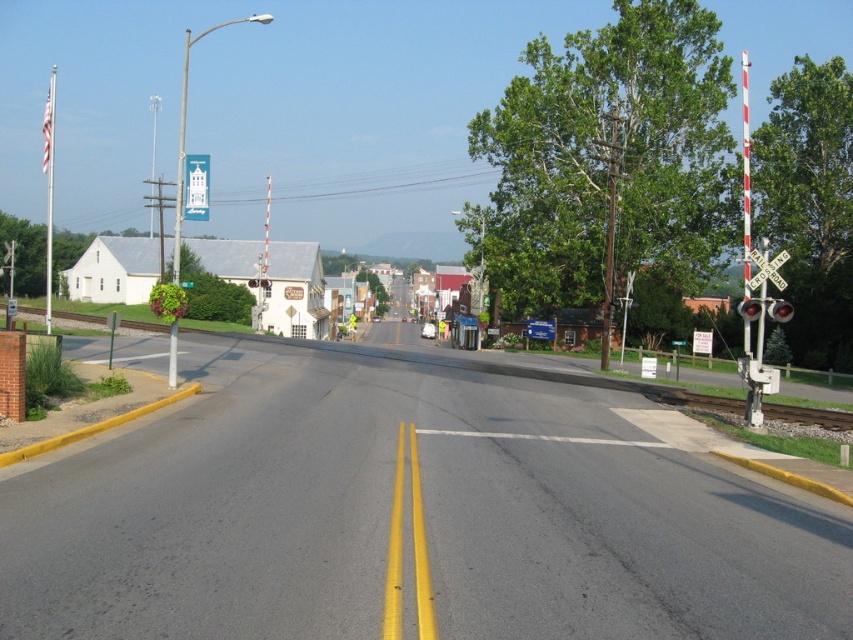
Looking at this image, you are standing at point (757,257) and want to walk to point (128,268). Based on the scene description, will you have to walk towards the road or away from it?

Since point (128,268) is behind point (757,257), you will have to walk towards the road to reach it.

You are standing at the point marked by coordinates point (115,269). Looking around, you see the white painted building at center. In which direction relative to your position is the white painted building at center located?

The white painted building at center is located at point (115,269), which is your current position. Therefore, you are standing right at the building.